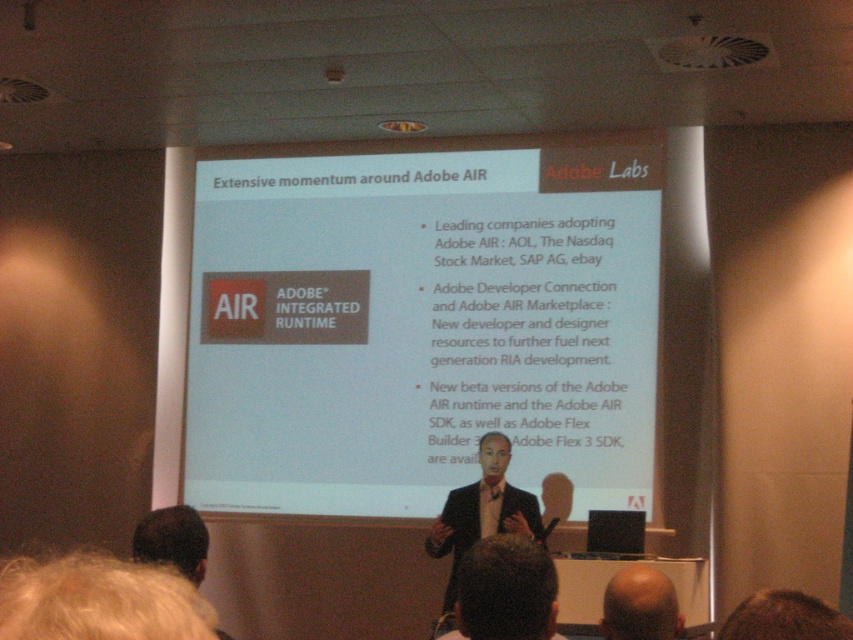
You are sitting in the conference room and want to hand a document to the person in the dark suit at lower center and the dark suit at center. Which person should you approach first to reach them without walking past the other?

You should approach the dark suit at lower center first because they are closer to you than the dark suit at center, so you can reach them without needing to walk past the other person.

You are an attendee at the presentation and want to take a photo of the presenter. The presenter is wearing a dark suit at lower center and has a bald head at center. Which object should you focus on to capture the presenter in the photo?

You should focus on both the dark suit at lower center and the bald head at center as they are part of the presenter. The dark suit at lower center is to the left of the bald head at center, so ensure both are in frame.